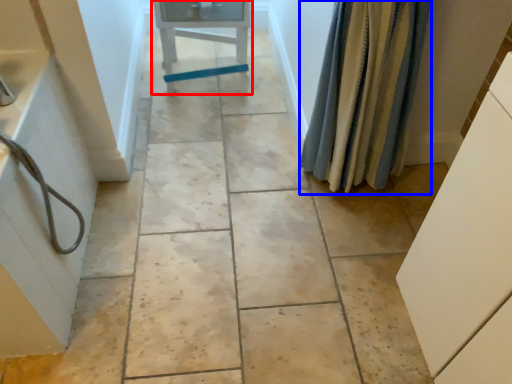
Question: Which point is closer to the camera, furniture (highlighted by a red box) or shower curtain (highlighted by a blue box)?

Choices:
 (A) furniture
 (B) shower curtain

Answer: (B)